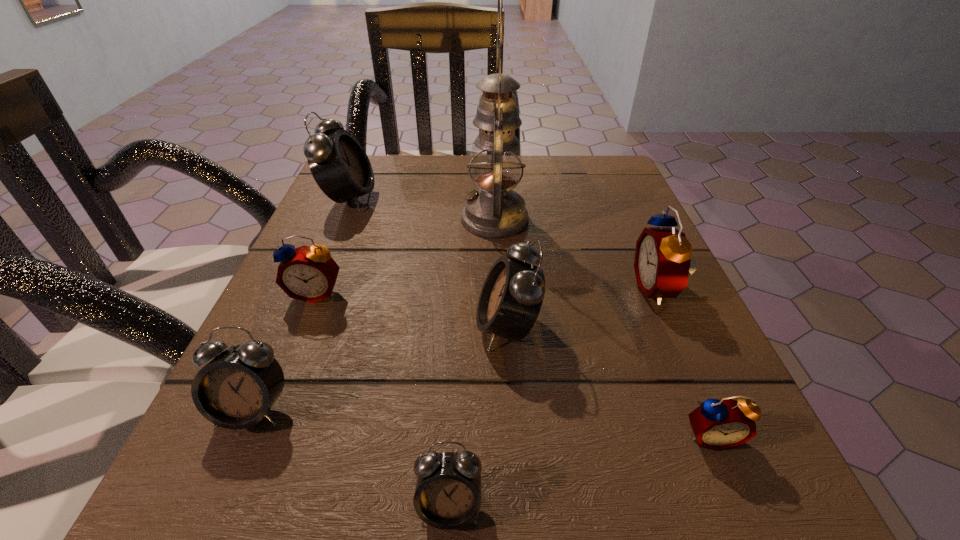
In the image, there is a desktop. Identify the location of vacant region at the far right corner. (595, 164).

The image size is (960, 540). I want to click on vacant point located between the second smallest white alarm clock and the nearest white alarm clock, so click(351, 458).

Image resolution: width=960 pixels, height=540 pixels. I want to click on free spot between the biggest red alarm clock and the second nearest white alarm clock, so click(x=455, y=349).

Where is `free space between the biggest red alarm clock and the third biggest white alarm clock`? The height and width of the screenshot is (540, 960). free space between the biggest red alarm clock and the third biggest white alarm clock is located at coordinates (455, 349).

Find the location of a particular element. Image resolution: width=960 pixels, height=540 pixels. empty location between the tallest object and the biggest red alarm clock is located at coordinates (576, 254).

The image size is (960, 540). Identify the location of free area in between the nearest red alarm clock and the tallest object. (603, 327).

Where is `free spot between the tallest object and the biggest red alarm clock`? The width and height of the screenshot is (960, 540). free spot between the tallest object and the biggest red alarm clock is located at coordinates (576, 254).

The image size is (960, 540). What are the coordinates of `blank region between the second smallest white alarm clock and the nearest red alarm clock` in the screenshot? It's located at (482, 423).

Identify the location of vacant space that is in between the biggest red alarm clock and the tallest alarm clock. Image resolution: width=960 pixels, height=540 pixels. (503, 244).

Identify the location of unoccupied area between the smallest red alarm clock and the biggest red alarm clock. (684, 362).